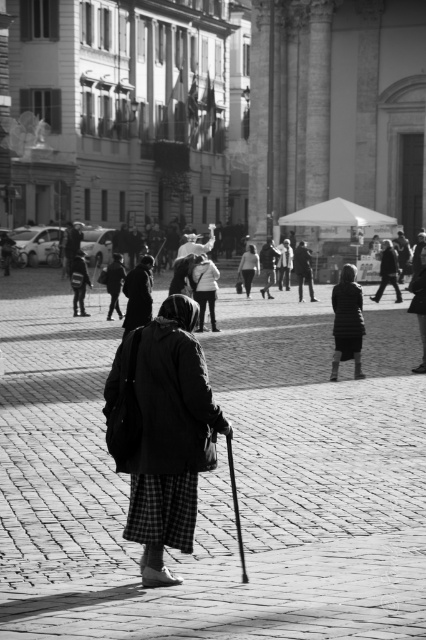
You are a photographer who wants to capture the elderly woman in the scene. The dark textured coat at center is represented by point (163, 432). Where should you position your camera to ensure the dark textured coat at center is in focus?

The dark textured coat at center is represented by point (163, 432). To ensure the dark textured coat at center is in focus, position the camera so that the lens is aimed directly at point (163, 432) where the dark textured coat at center is located.

You are a photographer trying to capture the scene in the image. You notice two coats in the center of the image. Which coat is positioned lower in the frame, the dark textured coat at center or the light gray fabric coat at center?

The dark textured coat at center is located below the light gray fabric coat at center, so the dark textured coat at center is positioned lower in the frame.